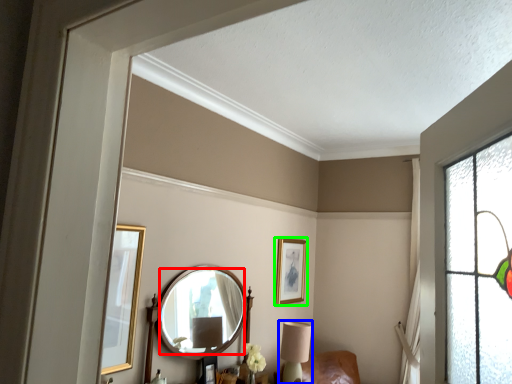
Question: Which is nearer to the mirror (highlighted by a red box)? table lamp (highlighted by a blue box) or picture frame (highlighted by a green box).

Choices:
 (A) table lamp
 (B) picture frame

Answer: (A)